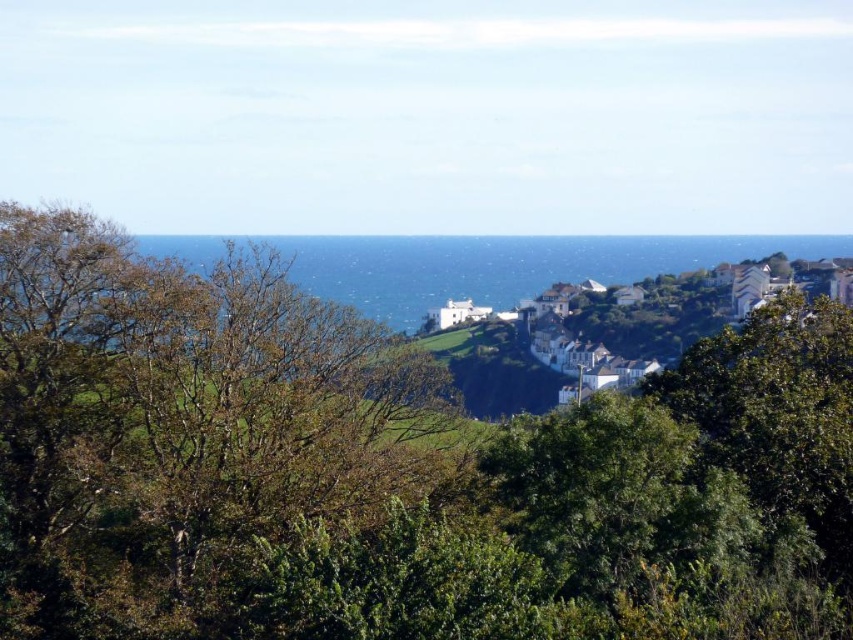
Question: Observing the image, what is the correct spatial positioning of brown leafy tree at center in reference to white painted houses at center?

Choices:
 (A) right
 (B) left

Answer: (B)

Question: Is blue water at center below white painted houses at center?

Choices:
 (A) no
 (B) yes

Answer: (A)

Question: Which point is farther from the camera taking this photo?

Choices:
 (A) (550, 269)
 (B) (637, 333)
 (C) (206, 481)

Answer: (A)

Question: Estimate the real-world distances between objects in this image. Which object is farther from the brown leafy tree at center?

Choices:
 (A) blue water at center
 (B) white painted houses at center

Answer: (B)

Question: Which object appears farthest from the camera in this image?

Choices:
 (A) white painted houses at center
 (B) brown leafy tree at center

Answer: (A)

Question: Is brown leafy tree at center bigger than white painted houses at center?

Choices:
 (A) no
 (B) yes

Answer: (A)